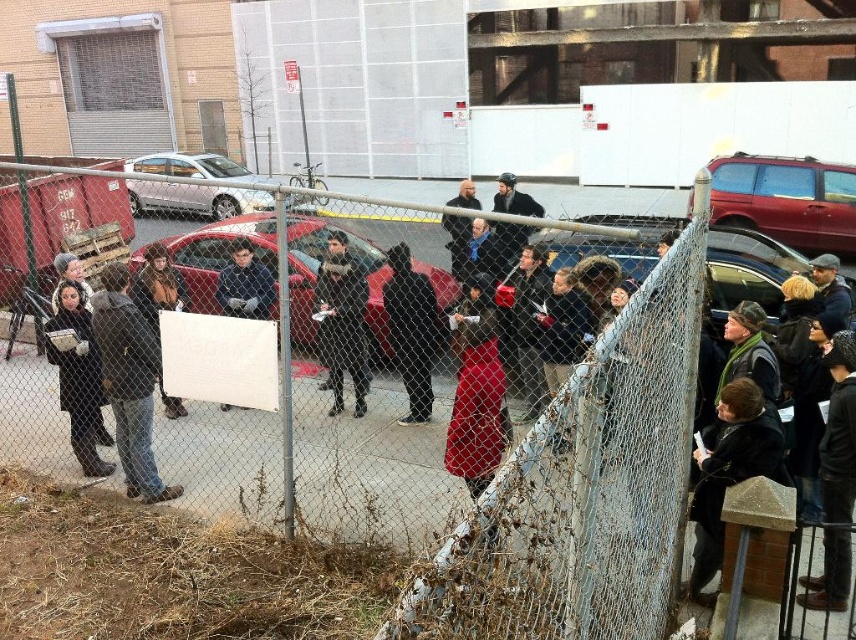
You are a photographer trying to capture a photo of the protest scene. You notice two individuals wearing a velvet red dress at center and a dark gray sweater at center. Which clothing item is positioned lower in the image?

The velvet red dress at center is located below the dark gray sweater at center, so the velvet red dress at center is positioned lower in the image.

You are a photographer at the protest scene and want to capture both the velvet red dress at center and the dark gray sweater at center in the same frame. Which direction should you move your camera to ensure both are visible?

The velvet red dress at center is positioned on the left side of dark gray sweater at center. To capture both in the same frame, move your camera to the right to include the velvet red dress at center and the dark gray sweater at center.